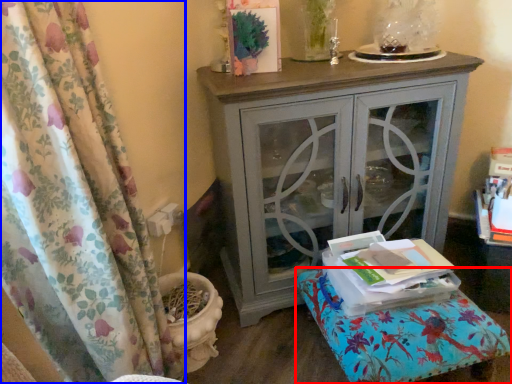
Question: Among these objects, which one is nearest to the camera, furniture (highlighted by a red box) or curtain (highlighted by a blue box)?

Choices:
 (A) furniture
 (B) curtain

Answer: (B)